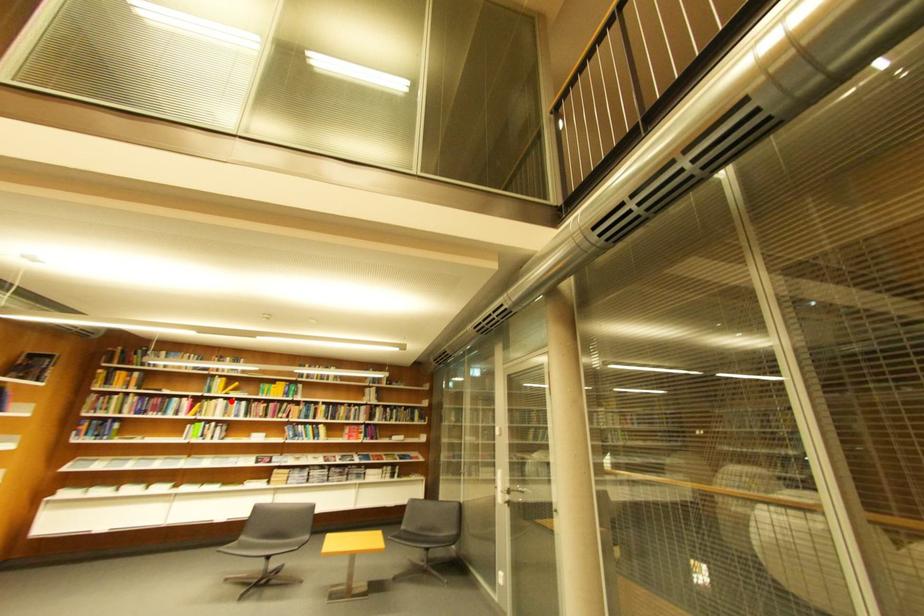
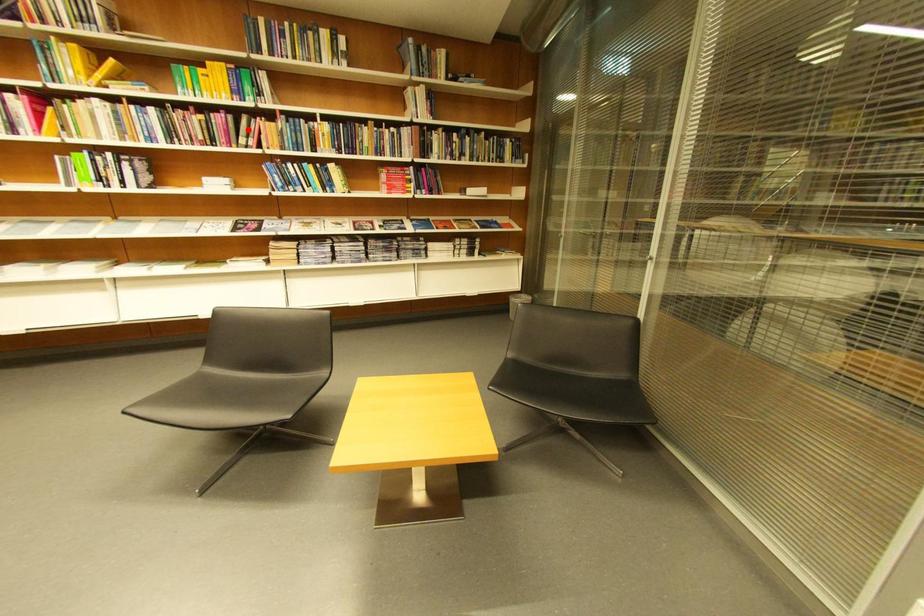
I am providing you with two images of the same scene from different viewpoints. A red point is marked on the first image and another point is marked on the second image. Do the highlighted points in image1 and image2 indicate the same real-world spot?

No